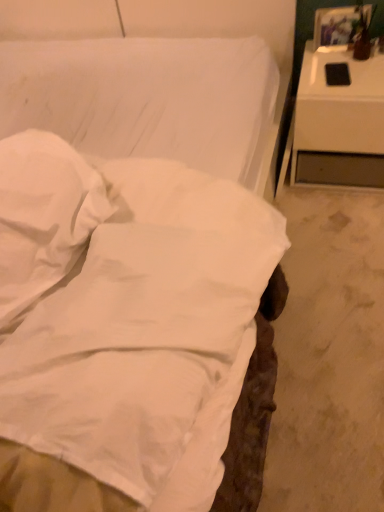
Question: Does white glossy nightstand at right come behind matte brown vase at upper right?

Choices:
 (A) yes
 (B) no

Answer: (B)

Question: Is white glossy nightstand at right oriented away from matte brown vase at upper right?

Choices:
 (A) no
 (B) yes

Answer: (A)

Question: Does white glossy nightstand at right touch matte brown vase at upper right?

Choices:
 (A) yes
 (B) no

Answer: (B)

Question: Is white glossy nightstand at right not close to matte brown vase at upper right?

Choices:
 (A) no
 (B) yes

Answer: (A)

Question: Is white glossy nightstand at right at the left side of matte brown vase at upper right?

Choices:
 (A) no
 (B) yes

Answer: (B)

Question: From a real-world perspective, is matte brown vase at upper right physically located above or below white glossy nightstand at right?

Choices:
 (A) above
 (B) below

Answer: (A)

Question: Is matte brown vase at upper right situated inside white glossy nightstand at right or outside?

Choices:
 (A) outside
 (B) inside

Answer: (A)

Question: Considering the positions of matte brown vase at upper right and white glossy nightstand at right in the image, is matte brown vase at upper right wider or thinner than white glossy nightstand at right?

Choices:
 (A) wide
 (B) thin

Answer: (B)

Question: Considering the positions of matte brown vase at upper right and white glossy nightstand at right in the image, is matte brown vase at upper right bigger or smaller than white glossy nightstand at right?

Choices:
 (A) big
 (B) small

Answer: (B)

Question: Is matte brown vase at upper right inside the boundaries of white soft pillow at center, or outside?

Choices:
 (A) outside
 (B) inside

Answer: (A)

Question: In the image, is matte brown vase at upper right positioned in front of or behind white soft pillow at center?

Choices:
 (A) front
 (B) behind

Answer: (B)

Question: Looking at the image, does matte brown vase at upper right seem bigger or smaller compared to white soft pillow at center?

Choices:
 (A) big
 (B) small

Answer: (B)

Question: Visually, is matte brown vase at upper right positioned to the left or to the right of white soft pillow at center?

Choices:
 (A) right
 (B) left

Answer: (A)

Question: From a real-world perspective, is white glossy nightstand at right physically located above or below matte brown vase at upper right?

Choices:
 (A) above
 (B) below

Answer: (B)

Question: In terms of width, does white glossy nightstand at right look wider or thinner when compared to matte brown vase at upper right?

Choices:
 (A) thin
 (B) wide

Answer: (B)